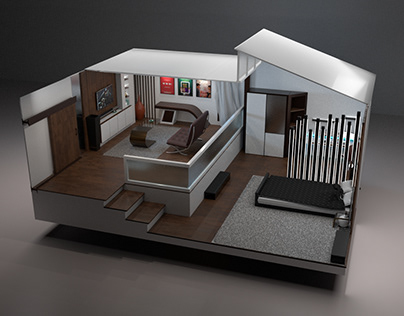
Locate an element on the screen. white curtain on the window on the right is located at coordinates (228, 97).